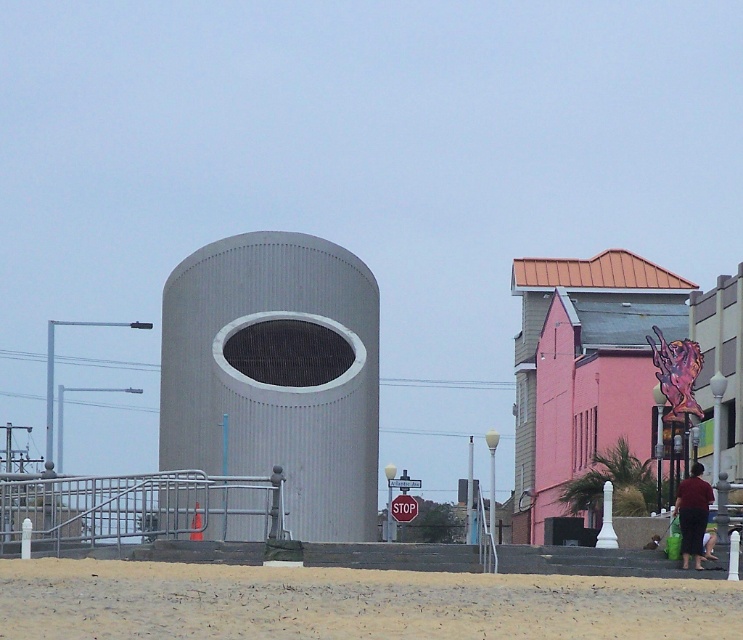
Between point (270, 314) and point (577, 336), which one is positioned in front?

Point (270, 314) is more forward.

What do you see at coordinates (276, 374) in the screenshot?
I see `gray corrugated metal cylinder at center` at bounding box center [276, 374].

What do you see at coordinates (276, 374) in the screenshot? I see `gray corrugated metal cylinder at center` at bounding box center [276, 374].

Find the location of a particular element. This screenshot has height=640, width=743. gray corrugated metal cylinder at center is located at coordinates (276, 374).

Does point (617, 308) come behind point (684, 512)?

Yes, it is behind point (684, 512).

From the picture: How much distance is there between pink matte building at upper right and dark red fabric pants at lower right?

pink matte building at upper right is 59.54 meters away from dark red fabric pants at lower right.

Who is more distant from viewer, (594, 376) or (698, 568)?

The point (594, 376) is more distant.

Identify the location of pink matte building at upper right. (583, 369).

Does gray corrugated metal cylinder at center have a smaller size compared to dark red fabric pants at lower right?

Actually, gray corrugated metal cylinder at center might be larger than dark red fabric pants at lower right.

What do you see at coordinates (276, 374) in the screenshot? I see `gray corrugated metal cylinder at center` at bounding box center [276, 374].

Does point (334, 323) lie in front of point (694, 472)?

No.

In order to click on gray corrugated metal cylinder at center in this screenshot , I will do `click(276, 374)`.